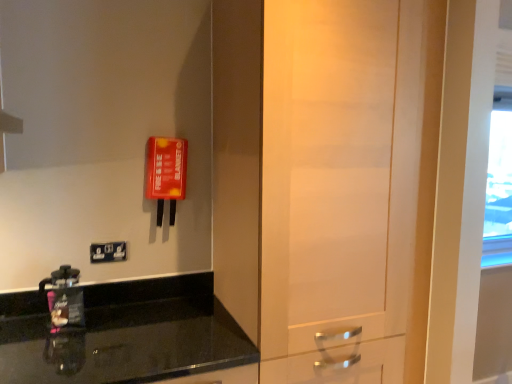
Question: Does matte wood door at center have a lesser height compared to black granite countertop at lower left?

Choices:
 (A) yes
 (B) no

Answer: (B)

Question: Does matte wood door at center turn towards black granite countertop at lower left?

Choices:
 (A) yes
 (B) no

Answer: (B)

Question: From the image's perspective, would you say matte wood door at center is positioned over black granite countertop at lower left?

Choices:
 (A) no
 (B) yes

Answer: (B)

Question: Is matte wood door at center at the right side of black granite countertop at lower left?

Choices:
 (A) no
 (B) yes

Answer: (B)

Question: Considering the relative sizes of matte wood door at center and black granite countertop at lower left in the image provided, is matte wood door at center thinner than black granite countertop at lower left?

Choices:
 (A) yes
 (B) no

Answer: (A)

Question: From a real-world perspective, is matte wood door at center located beneath black granite countertop at lower left?

Choices:
 (A) no
 (B) yes

Answer: (A)

Question: Does matte wood door at center have a lesser width compared to matte black coffee maker at lower left?

Choices:
 (A) no
 (B) yes

Answer: (A)

Question: Is matte wood door at center surrounding matte black coffee maker at lower left?

Choices:
 (A) no
 (B) yes

Answer: (A)

Question: Is matte wood door at center outside matte black coffee maker at lower left?

Choices:
 (A) yes
 (B) no

Answer: (A)

Question: From the image's perspective, is matte wood door at center located above matte black coffee maker at lower left?

Choices:
 (A) no
 (B) yes

Answer: (B)

Question: From a real-world perspective, is matte wood door at center physically above matte black coffee maker at lower left?

Choices:
 (A) no
 (B) yes

Answer: (B)

Question: Is matte wood door at center at the left side of matte black coffee maker at lower left?

Choices:
 (A) yes
 (B) no

Answer: (B)

Question: Considering the relative positions of matte black coffee maker at lower left and matte wood door at center in the image provided, is matte black coffee maker at lower left to the right of matte wood door at center from the viewer's perspective?

Choices:
 (A) yes
 (B) no

Answer: (B)